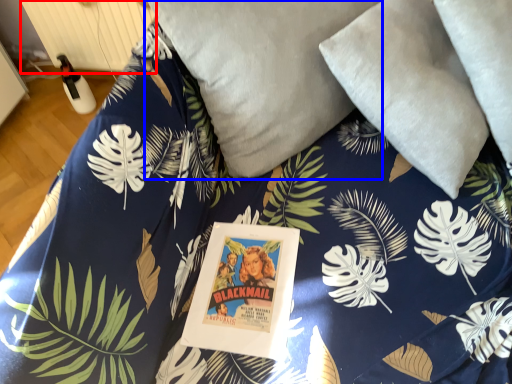
Question: Which of the following is the farthest to the observer, radiator (highlighted by a red box) or pillow (highlighted by a blue box)?

Choices:
 (A) radiator
 (B) pillow

Answer: (A)